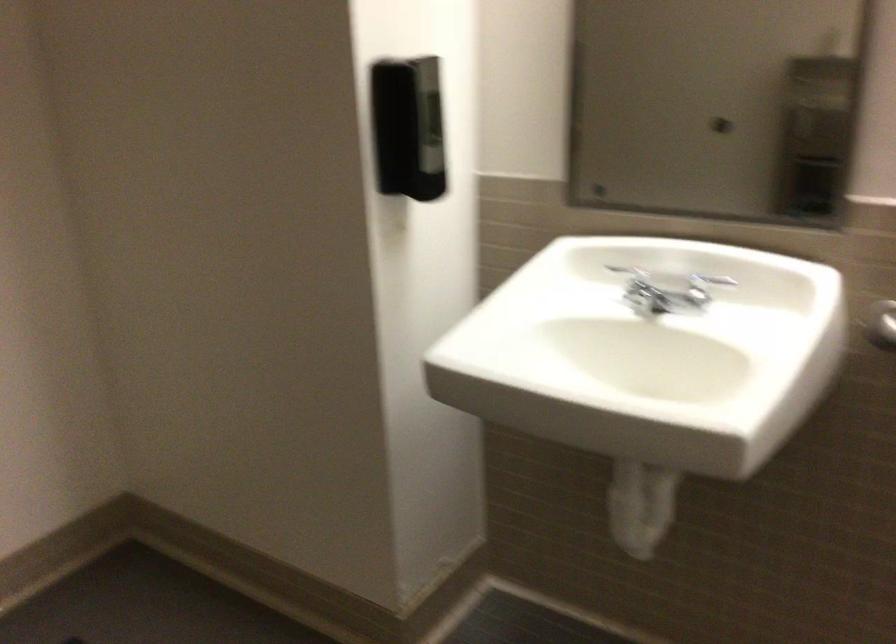
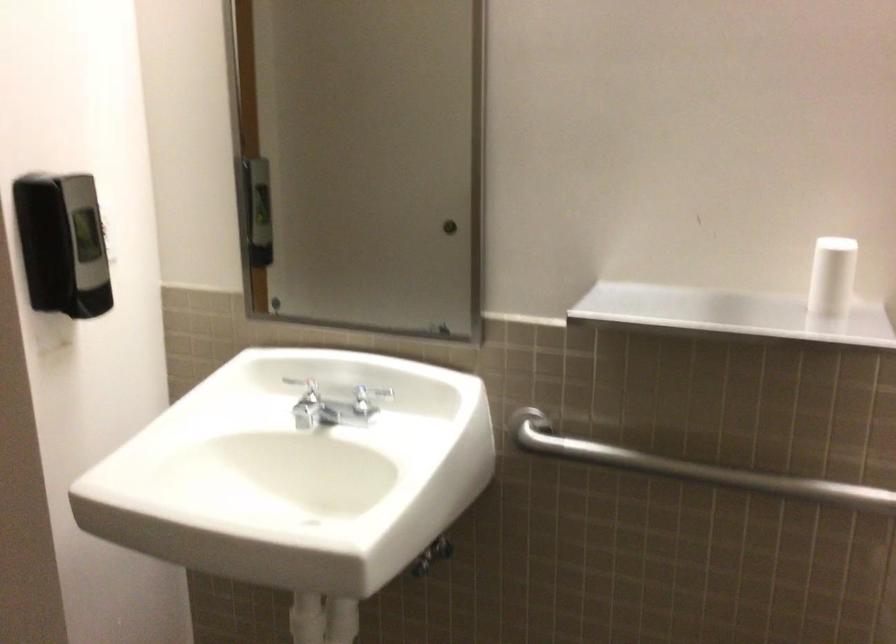
In the second image, find the point that corresponds to (701,285) in the first image.

(368, 397)